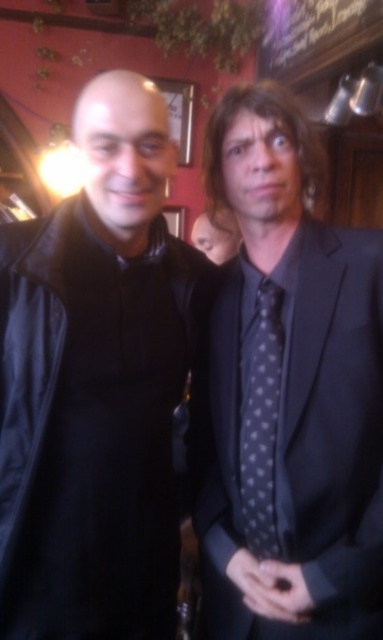
You are a photographer adjusting your camera settings to capture both the polka dot silk tie at right and the polka dot silk tie at center in the same frame. Which tie should you focus on first if you want to ensure both are in focus without adjusting the focus distance?

The polka dot silk tie at right has a greater height compared to the polka dot silk tie at center, so focusing on the polka dot silk tie at right first would ensure both are in focus since it is farther away and has a larger depth of field.

From the picture: You are a photographer adjusting your camera settings. You notice the black leather jacket at left and the polka dot silk tie at right in your frame. Which object is positioned higher in the image?

The black leather jacket at left is positioned higher in the image than the polka dot silk tie at right.

You are standing in a bar and see the two people in the image. The black leather jacket at left is represented by point (96, 385). Is the jacket closer to the red wall or the greenery?

The black leather jacket at left is represented by point (96, 385). Since the red wall is on the background and the greenery is hanging from above, the jacket is closer to the greenery.